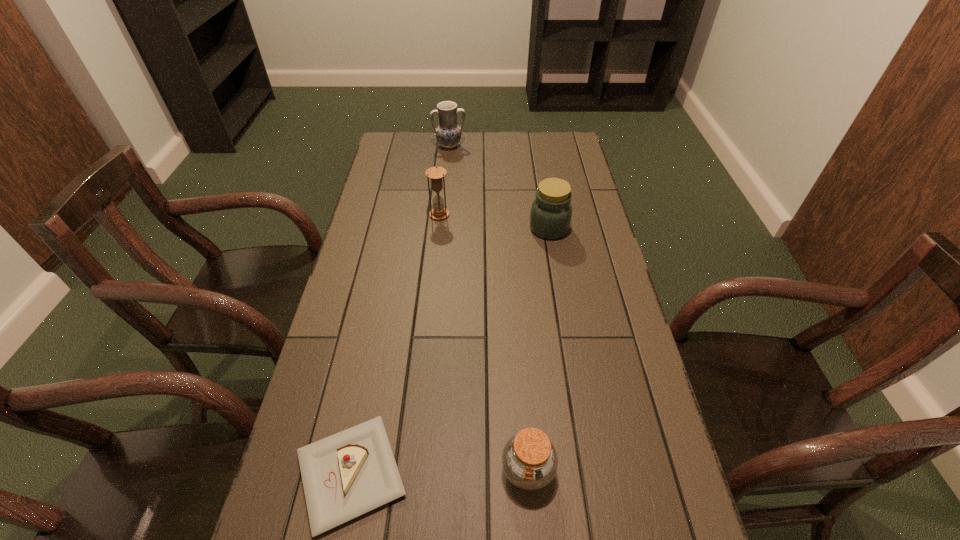
In order to click on vacant space situated on the left of the fourth tallest object in this screenshot , I will do `click(371, 470)`.

Identify the location of vacant space located on the right of the shortest object. The height and width of the screenshot is (540, 960). (442, 474).

Image resolution: width=960 pixels, height=540 pixels. Identify the location of object that is at the far edge. (448, 134).

Identify the location of object positioned at the left edge. (350, 473).

The width and height of the screenshot is (960, 540). What are the coordinates of `object present at the right edge` in the screenshot? It's located at (551, 211).

Identify the location of free space at the far edge. This screenshot has height=540, width=960. (467, 157).

The image size is (960, 540). I want to click on free space at the left edge of the desktop, so click(x=361, y=269).

At what (x,y) coordinates should I click in order to perform the action: click on vacant space at the right edge. Please return your answer as a coordinate pair (x, y). The height and width of the screenshot is (540, 960). Looking at the image, I should click on (595, 303).

Identify the location of free space at the far left corner. (407, 138).

Where is `free space between the second shortest object and the taller jar`? free space between the second shortest object and the taller jar is located at coordinates (539, 349).